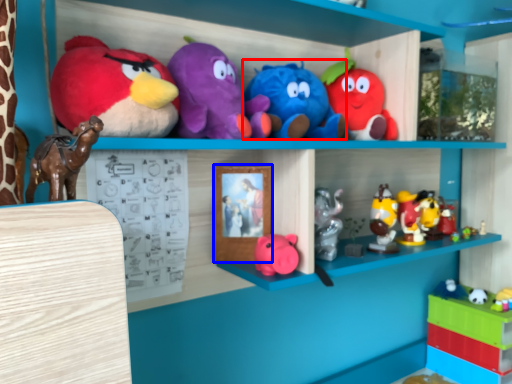
Question: Which of the following is the farthest to the observer, toy (highlighted by a red box) or picture frame (highlighted by a blue box)?

Choices:
 (A) toy
 (B) picture frame

Answer: (B)